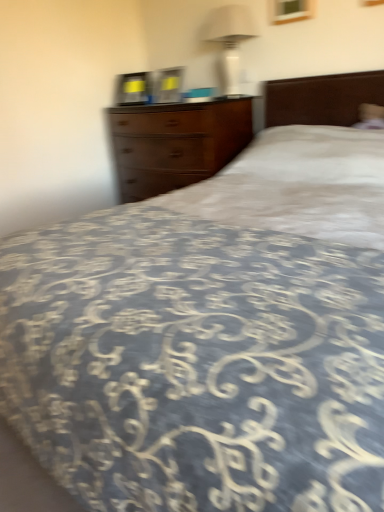
Question: From the image's perspective, is wooden chest of drawers at center on white glossy lampshade at upper center?

Choices:
 (A) yes
 (B) no

Answer: (B)

Question: Does wooden chest of drawers at center have a lesser width compared to white glossy lampshade at upper center?

Choices:
 (A) no
 (B) yes

Answer: (A)

Question: Does wooden chest of drawers at center contain white glossy lampshade at upper center?

Choices:
 (A) no
 (B) yes

Answer: (A)

Question: From a real-world perspective, is wooden chest of drawers at center positioned under white glossy lampshade at upper center based on gravity?

Choices:
 (A) yes
 (B) no

Answer: (A)

Question: Is wooden chest of drawers at center positioned beyond the bounds of white glossy lampshade at upper center?

Choices:
 (A) yes
 (B) no

Answer: (A)

Question: Can you confirm if wooden chest of drawers at center is bigger than white glossy lampshade at upper center?

Choices:
 (A) yes
 (B) no

Answer: (A)

Question: Is the depth of white glossy lampshade at upper center greater than that of wooden chest of drawers at center?

Choices:
 (A) no
 (B) yes

Answer: (B)

Question: Are white glossy lampshade at upper center and wooden chest of drawers at center far apart?

Choices:
 (A) no
 (B) yes

Answer: (A)

Question: Can you confirm if white glossy lampshade at upper center is wider than wooden chest of drawers at center?

Choices:
 (A) yes
 (B) no

Answer: (B)

Question: Is white glossy lampshade at upper center not within wooden chest of drawers at center?

Choices:
 (A) no
 (B) yes

Answer: (B)

Question: Does white glossy lampshade at upper center appear on the left side of wooden chest of drawers at center?

Choices:
 (A) no
 (B) yes

Answer: (A)

Question: From a real-world perspective, is white glossy lampshade at upper center beneath wooden chest of drawers at center?

Choices:
 (A) no
 (B) yes

Answer: (A)

Question: Is wooden chest of drawers at center wider or thinner than white glossy lampshade at upper center?

Choices:
 (A) wide
 (B) thin

Answer: (A)